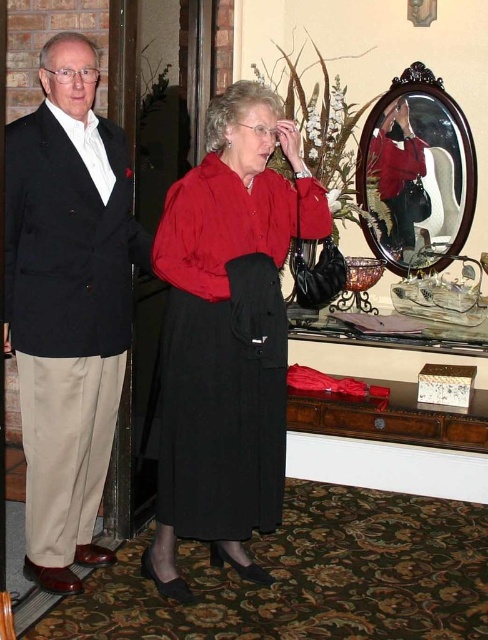
You are standing in the room and want to place a small potted plant between the two points, point (61, 308) and point (268, 330). Which point should the plant be closer to in order to be closer to the viewer?

A: The plant should be closer to point (61, 308) because it is further to the viewer than point (268, 330).

You are a guest at a party and see the velvet red dress at center and the wooden oval mirror at upper center. Which object is positioned to the left side of the other?

The velvet red dress at center is to the left of the wooden oval mirror at upper center.